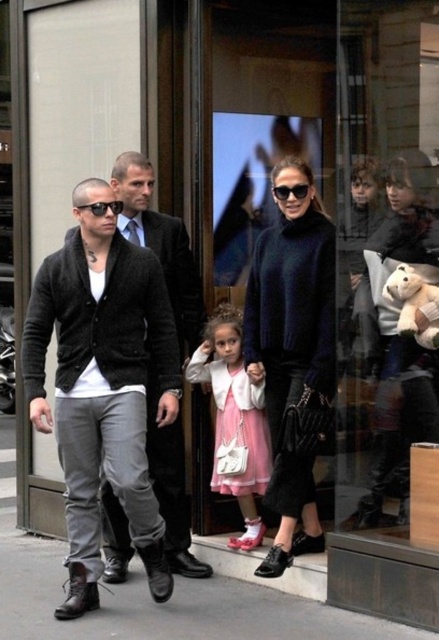
Based on the photo, is dark gray knit sweater at center smaller than black plastic sunglasses at center?

No, dark gray knit sweater at center is not smaller than black plastic sunglasses at center.

Between point (172, 444) and point (302, 195), which one is positioned behind?

The point (172, 444) is more distant.

Locate an element on the screen. The width and height of the screenshot is (439, 640). dark gray knit sweater at center is located at coordinates (161, 243).

Does dark gray cardigan at left appear under black plastic sunglasses at left?

Yes, dark gray cardigan at left is below black plastic sunglasses at left.

How far apart are dark gray cardigan at left and black plastic sunglasses at left?

The distance of dark gray cardigan at left from black plastic sunglasses at left is 88.37 centimeters.

The width and height of the screenshot is (439, 640). Identify the location of dark gray cardigan at left. (103, 387).

Locate an element on the screen. dark gray cardigan at left is located at coordinates (103, 387).

Who is taller, dark gray knit sweater at center or white plush teddy bear at center?

dark gray knit sweater at center is taller.

Which is above, dark gray knit sweater at center or white plush teddy bear at center?

dark gray knit sweater at center is higher up.

Measure the distance between point (197, 308) and camera.

Point (197, 308) is 4.82 meters from camera.

Locate an element on the screen. The height and width of the screenshot is (640, 439). dark gray knit sweater at center is located at coordinates (161, 243).